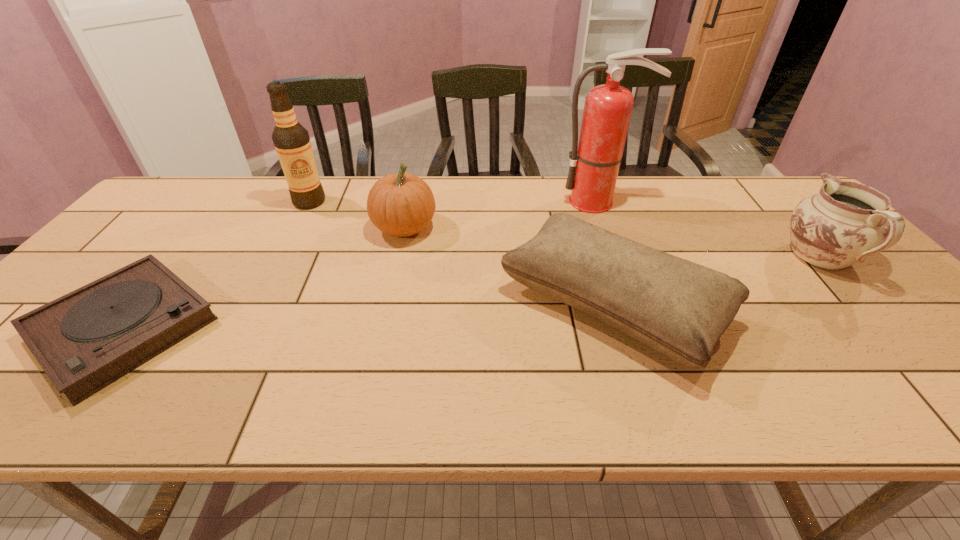
The height and width of the screenshot is (540, 960). What are the coordinates of `fire extinguisher` in the screenshot? It's located at (594, 164).

Where is `the fifth object from right to left`? the fifth object from right to left is located at coordinates (291, 140).

You are a GUI agent. You are given a task and a screenshot of the screen. Output one action in this format:
    pyautogui.click(x=<x>, y=<y>)
    Task: Click on the alcohol
    This screenshot has width=960, height=540.
    Given the screenshot: What is the action you would take?
    pos(291,140)

The height and width of the screenshot is (540, 960). I want to click on pumpkin, so click(401, 204).

Find the location of `pitcher`. pitcher is located at coordinates (844, 223).

The image size is (960, 540). What are the coordinates of `cushion` in the screenshot? It's located at (680, 309).

Find the location of a particular element. free space located 0.250m with the handle and hose on the fire extinguisher is located at coordinates (620, 267).

The height and width of the screenshot is (540, 960). In order to click on free region located 0.190m on the label of the alcohol in this screenshot , I will do `click(284, 249)`.

Locate an element on the screen. The image size is (960, 540). free space located on the stem of the third object from left to right is located at coordinates (454, 228).

Where is `vacant space situated on the spout of the rightmost object`? vacant space situated on the spout of the rightmost object is located at coordinates (751, 180).